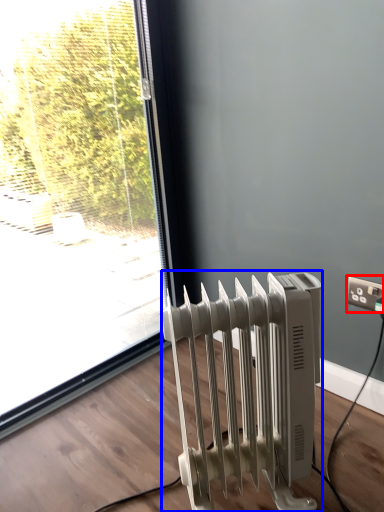
Question: Which of the following is the closest to the observer, electric outlet (highlighted by a red box) or radiator (highlighted by a blue box)?

Choices:
 (A) electric outlet
 (B) radiator

Answer: (B)